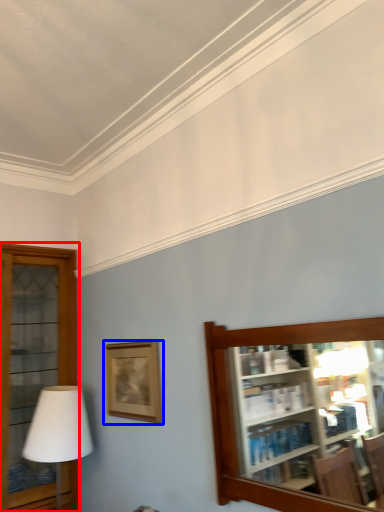
Question: Among these objects, which one is farthest to the camera, shelf (highlighted by a red box) or picture frame (highlighted by a blue box)?

Choices:
 (A) shelf
 (B) picture frame

Answer: (A)